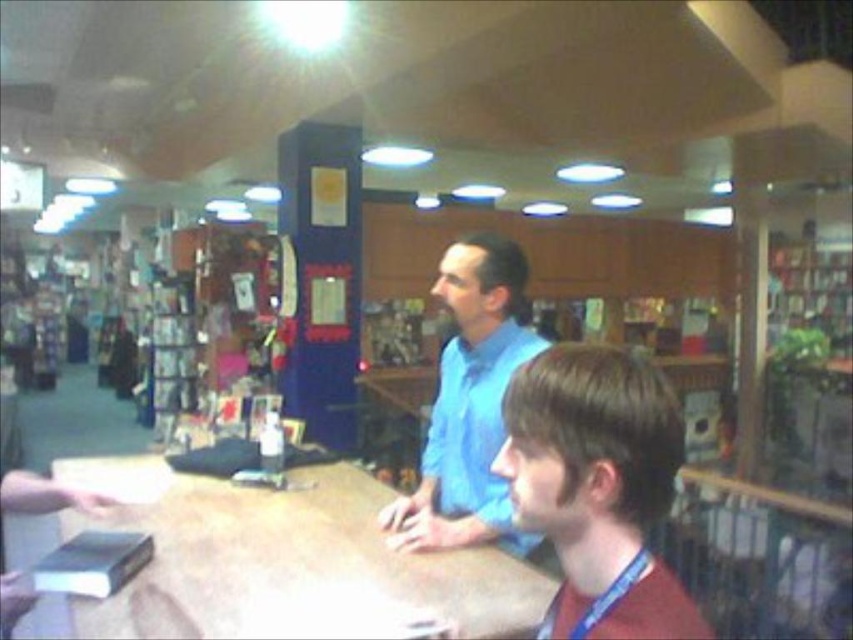
Is wooden table at center shorter than blue cotton shirt at center?

Yes, wooden table at center is shorter than blue cotton shirt at center.

In the scene shown: Is wooden table at center behind blue cotton shirt at center?

No.

Is point (238, 570) less distant than point (450, 472)?

That is True.

You are a GUI agent. You are given a task and a screenshot of the screen. Output one action in this format:
    pyautogui.click(x=<x>, y=<y>)
    Task: Click on the wooden table at center
    This screenshot has height=640, width=853.
    Given the screenshot: What is the action you would take?
    pyautogui.click(x=283, y=560)

Is brown matte hair at center to the left of blue cotton shirt at center from the viewer's perspective?

In fact, brown matte hair at center is to the right of blue cotton shirt at center.

This screenshot has width=853, height=640. Identify the location of brown matte hair at center. (598, 486).

From the picture: Who is more distant from viewer, (621, 451) or (486, 253)?

Point (486, 253)

Locate an element on the screen. The height and width of the screenshot is (640, 853). brown matte hair at center is located at coordinates (598, 486).

Can you confirm if wooden table at center is shorter than brown matte hair at center?

Yes, wooden table at center is shorter than brown matte hair at center.

Does wooden table at center lie in front of brown matte hair at center?

No, wooden table at center is further to the viewer.

Between point (114, 513) and point (553, 470), which one is positioned in front?

Point (553, 470)

Locate an element on the screen. wooden table at center is located at coordinates tap(283, 560).